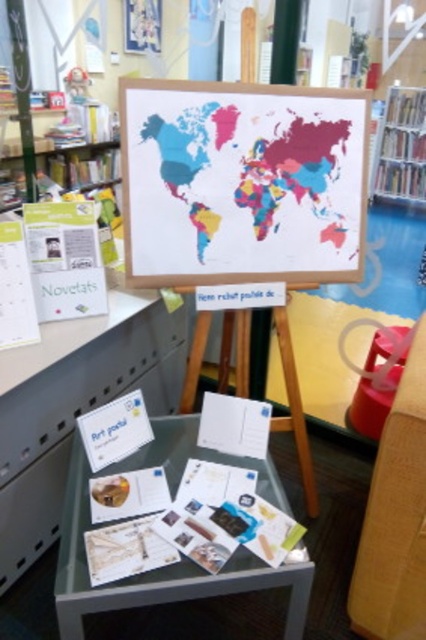
Is matte plastic table at lower center closer to the viewer compared to matte plastic stool at lower right?

Yes.

Does matte plastic table at lower center have a lesser width compared to matte plastic stool at lower right?

No.

Who is more distant from viewer, (129, 381) or (356, 392)?

Point (356, 392)

At what (x,y) coordinates should I click in order to perform the action: click on matte plastic table at lower center. Please return your answer as a coordinate pair (x, y). This screenshot has width=426, height=640. Looking at the image, I should click on (74, 419).

Does point (314, 280) lie in front of point (365, 554)?

No, it is not.

Which is below, colorful paper map at center or smooth plastic chair at lower right?

smooth plastic chair at lower right is lower down.

The height and width of the screenshot is (640, 426). Find the location of `colorful paper map at center`. colorful paper map at center is located at coordinates (241, 182).

The height and width of the screenshot is (640, 426). I want to click on colorful paper map at center, so click(x=241, y=182).

Is colorful paper map at center above matte plastic stool at lower right?

Correct, colorful paper map at center is located above matte plastic stool at lower right.

From the picture: Does colorful paper map at center appear on the right side of matte plastic stool at lower right?

Incorrect, colorful paper map at center is not on the right side of matte plastic stool at lower right.

The width and height of the screenshot is (426, 640). What do you see at coordinates (241, 182) in the screenshot? I see `colorful paper map at center` at bounding box center [241, 182].

Find the location of a particular element. This screenshot has width=426, height=640. colorful paper map at center is located at coordinates (241, 182).